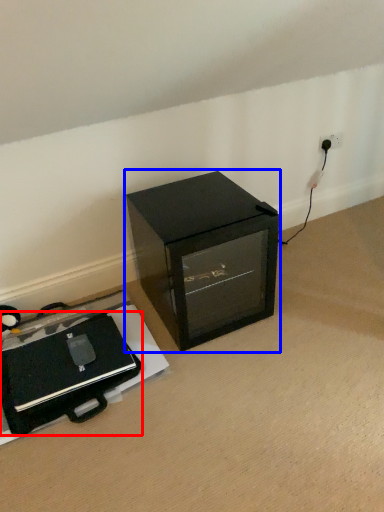
Question: Which point is closer to the camera, wide (highlighted by a red box) or furniture (highlighted by a blue box)?

Choices:
 (A) wide
 (B) furniture

Answer: (A)